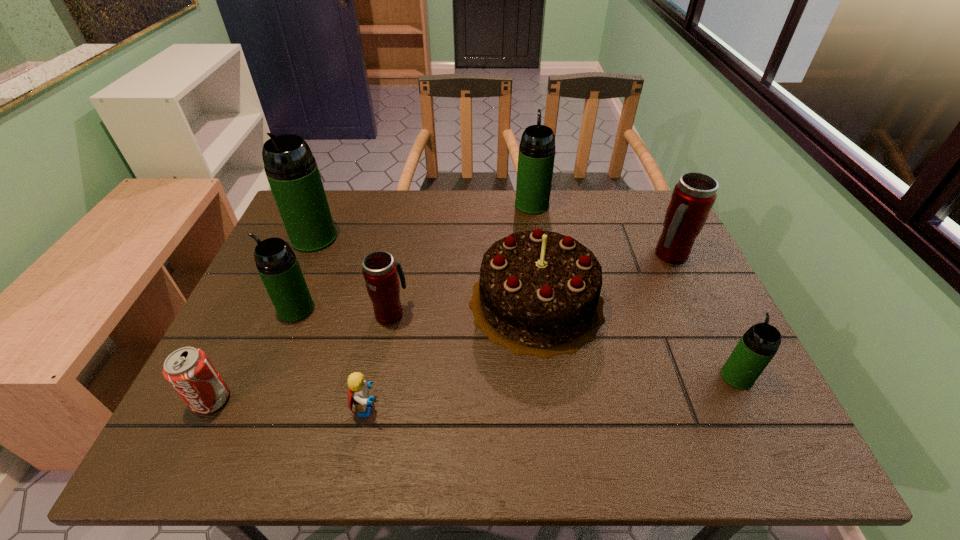
Find the location of a particular element. the tallest thermos bottle is located at coordinates (292, 172).

Image resolution: width=960 pixels, height=540 pixels. What are the coordinates of `the biggest green thermos bottle` in the screenshot? It's located at (292, 172).

Locate an element on the screen. the farthest object is located at coordinates (536, 156).

The image size is (960, 540). In order to click on the third green thermos bottle from left to right in this screenshot , I will do `click(536, 156)`.

Identify the location of the farther red thermos bottle. (694, 195).

Locate an element on the screen. The height and width of the screenshot is (540, 960). the bigger red thermos bottle is located at coordinates (694, 195).

Where is `the third biggest green thermos bottle`? The height and width of the screenshot is (540, 960). the third biggest green thermos bottle is located at coordinates (276, 262).

You are a GUI agent. You are given a task and a screenshot of the screen. Output one action in this format:
    pyautogui.click(x=<x>, y=<y>)
    Task: Click on the birthday cake
    The image size is (960, 540).
    Given the screenshot: What is the action you would take?
    pyautogui.click(x=538, y=294)

Locate an element on the screen. the nearest thermos bottle is located at coordinates point(759,344).

Locate an element on the screen. This screenshot has height=540, width=960. the rightmost green thermos bottle is located at coordinates (759, 344).